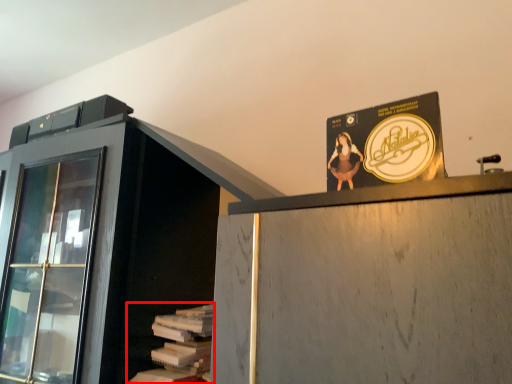
Question: From the image's perspective, what is the correct spatial positioning of book (annotated by the red box) in reference to advertisement?

Choices:
 (A) below
 (B) above

Answer: (A)